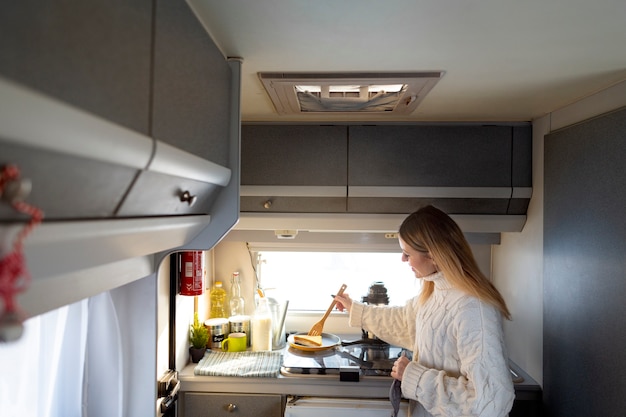
Locate an element on the screen. knob is located at coordinates (183, 200), (233, 409), (264, 203).